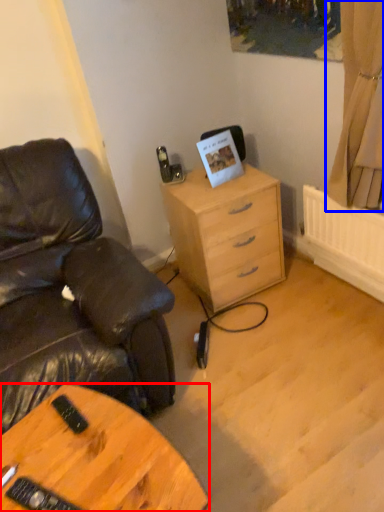
Question: Which object appears closest to the camera in this image, desk (highlighted by a red box) or curtain (highlighted by a blue box)?

Choices:
 (A) desk
 (B) curtain

Answer: (A)